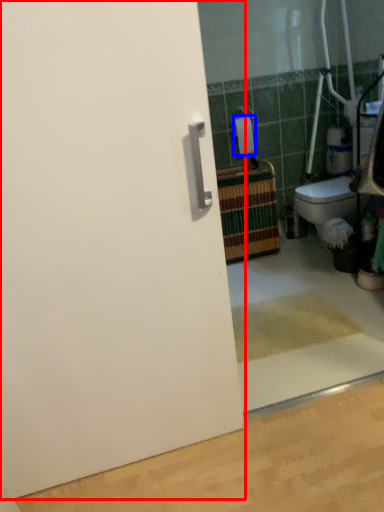
Question: Among these objects, which one is farthest to the camera, door (highlighted by a red box) or toilet paper (highlighted by a blue box)?

Choices:
 (A) door
 (B) toilet paper

Answer: (B)